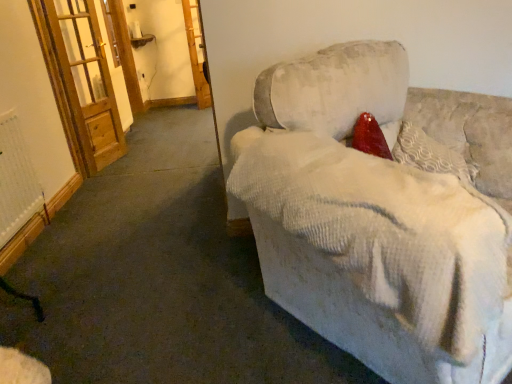
Find the location of a particular element. Image resolution: width=512 pixels, height=384 pixels. velvet beige couch at center is located at coordinates (372, 225).

This screenshot has width=512, height=384. In order to click on textured cream pillow at upper right in this screenshot , I will do `click(430, 154)`.

Where is `white textured radiator at lower left`? white textured radiator at lower left is located at coordinates (16, 180).

Where is `wooden screen door at upper left, the 2th screen door from the front`? This screenshot has height=384, width=512. wooden screen door at upper left, the 2th screen door from the front is located at coordinates (196, 52).

Considering the relative sizes of wooden screen door at upper left, the 2th screen door from the front, and textured cream pillow at upper right in the image provided, is wooden screen door at upper left, the 2th screen door from the front, bigger than textured cream pillow at upper right?

No, wooden screen door at upper left, the 2th screen door from the front, is not bigger than textured cream pillow at upper right.

Which is more to the left, wooden screen door at upper left, which is counted as the second screen door, starting from the left, or textured cream pillow at upper right?

wooden screen door at upper left, which is counted as the second screen door, starting from the left, is more to the left.

Which of these two, wooden screen door at upper left, placed as the first screen door when sorted from back to front, or textured cream pillow at upper right, stands shorter?

textured cream pillow at upper right.

From the image's perspective, relative to wooden screen door at left, the 1th screen door from the left, is velvet beige couch at center above or below?

velvet beige couch at center is below wooden screen door at left, the 1th screen door from the left.

Consider the image. Is velvet beige couch at center located outside wooden screen door at left, positioned as the first screen door in front-to-back order?

Yes, velvet beige couch at center is not within wooden screen door at left, positioned as the first screen door in front-to-back order.

Considering the positions of point (204, 105) and point (82, 14), is point (204, 105) closer or farther from the camera than point (82, 14)?

Point (204, 105) is farther from the camera than point (82, 14).

Does wooden screen door at upper left, which is counted as the second screen door, starting from the left, have a lesser height compared to wooden screen door at left, the second screen door viewed from the right?

Correct, wooden screen door at upper left, which is counted as the second screen door, starting from the left, is not as tall as wooden screen door at left, the second screen door viewed from the right.

From the image's perspective, would you say wooden screen door at upper left, marked as the first screen door in a right-to-left arrangement, is shown under wooden screen door at left, the second screen door viewed from the right?

No.

Relative to wooden screen door at left, the 1th screen door from the left, is wooden screen door at upper left, which is counted as the second screen door, starting from the left, in front or behind?

wooden screen door at upper left, which is counted as the second screen door, starting from the left, is behind wooden screen door at left, the 1th screen door from the left.

Would you say textured cream pillow at upper right is to the left or to the right of wooden screen door at left, the second screen door viewed from the right, in the picture?

In the image, textured cream pillow at upper right appears on the right side of wooden screen door at left, the second screen door viewed from the right.

Measure the distance from textured cream pillow at upper right to wooden screen door at left, the 1th screen door from the left.

2.70 meters.

How many degrees apart are the facing directions of textured cream pillow at upper right and wooden screen door at left, positioned as the first screen door in front-to-back order?

29.9 degrees separate the facing orientations of textured cream pillow at upper right and wooden screen door at left, positioned as the first screen door in front-to-back order.

Is textured cream pillow at upper right positioned beyond the bounds of wooden screen door at left, positioned as the 2th screen door in back-to-front order?

textured cream pillow at upper right lies outside wooden screen door at left, positioned as the 2th screen door in back-to-front order,'s area.

Between wooden screen door at left, positioned as the first screen door in front-to-back order, and wooden screen door at upper left, which is counted as the second screen door, starting from the left, which one has smaller size?

With smaller size is wooden screen door at upper left, which is counted as the second screen door, starting from the left.

Can you confirm if wooden screen door at left, positioned as the first screen door in front-to-back order, is thinner than wooden screen door at upper left, marked as the first screen door in a right-to-left arrangement?

No.

Are wooden screen door at left, the 1th screen door from the left, and wooden screen door at upper left, placed as the first screen door when sorted from back to front, far apart?

Yes, wooden screen door at left, the 1th screen door from the left, is far from wooden screen door at upper left, placed as the first screen door when sorted from back to front.

Which point is more distant from viewer, (5, 144) or (432, 157)?

The point (5, 144) is farther from the camera.

Which of these two, white textured radiator at lower left or textured cream pillow at upper right, stands shorter?

textured cream pillow at upper right.

Is white textured radiator at lower left not within textured cream pillow at upper right?

white textured radiator at lower left is positioned outside textured cream pillow at upper right.

Is white textured radiator at lower left next to textured cream pillow at upper right and touching it?

white textured radiator at lower left is not next to textured cream pillow at upper right, and they're not touching.

Is the position of textured cream pillow at upper right less distant than that of velvet beige couch at center?

No, textured cream pillow at upper right is further to the viewer.

Is textured cream pillow at upper right with velvet beige couch at center?

No.

From the image's perspective, is textured cream pillow at upper right located above velvet beige couch at center?

Indeed, from the image's perspective, textured cream pillow at upper right is shown above velvet beige couch at center.

Can you tell me how much textured cream pillow at upper right and velvet beige couch at center differ in facing direction?

The angle between the facing direction of textured cream pillow at upper right and the facing direction of velvet beige couch at center is 4.32 degrees.

This screenshot has height=384, width=512. Find the location of `pillow below the wooden screen door at upper left, which is counted as the second screen door, starting from the left (from the image's perspective)`. pillow below the wooden screen door at upper left, which is counted as the second screen door, starting from the left (from the image's perspective) is located at coordinates (430, 154).

You are a GUI agent. You are given a task and a screenshot of the screen. Output one action in this format:
    pyautogui.click(x=<x>, y=<y>)
    Task: Click on the studio couch that appears on the right of wooden screen door at left, the second screen door viewed from the right
    
    Given the screenshot: What is the action you would take?
    pyautogui.click(x=372, y=225)

Estimate the real-world distances between objects in this image. Which object is closer to white textured radiator at lower left, wooden screen door at left, positioned as the 2th screen door in back-to-front order, or velvet beige couch at center?

wooden screen door at left, positioned as the 2th screen door in back-to-front order.

Considering their positions, is wooden screen door at upper left, which is counted as the second screen door, starting from the left, positioned further to velvet beige couch at center than textured cream pillow at upper right?

wooden screen door at upper left, which is counted as the second screen door, starting from the left, is further to velvet beige couch at center.

From the image, which object appears to be farther from wooden screen door at left, the 1th screen door from the left, textured cream pillow at upper right or velvet beige couch at center?

Based on the image, textured cream pillow at upper right appears to be further to wooden screen door at left, the 1th screen door from the left.

When comparing their distances from velvet beige couch at center, does white textured radiator at lower left or textured cream pillow at upper right seem closer?

textured cream pillow at upper right lies closer to velvet beige couch at center than the other object.

From the image, which object appears to be farther from wooden screen door at upper left, the 2th screen door from the front, white textured radiator at lower left or velvet beige couch at center?

Among the two, velvet beige couch at center is located further to wooden screen door at upper left, the 2th screen door from the front.

Looking at the image, which one is located further to textured cream pillow at upper right, wooden screen door at left, positioned as the 2th screen door in back-to-front order, or wooden screen door at upper left, marked as the first screen door in a right-to-left arrangement?

The object further to textured cream pillow at upper right is wooden screen door at upper left, marked as the first screen door in a right-to-left arrangement.

Estimate the real-world distances between objects in this image. Which object is closer to textured cream pillow at upper right, velvet beige couch at center or white textured radiator at lower left?

velvet beige couch at center is positioned closer to the anchor textured cream pillow at upper right.

Considering their positions, is wooden screen door at left, the second screen door viewed from the right, positioned closer to velvet beige couch at center than wooden screen door at upper left, marked as the first screen door in a right-to-left arrangement?

wooden screen door at left, the second screen door viewed from the right.

At what (x,y) coordinates should I click in order to perform the action: click on screen door positioned between white textured radiator at lower left and wooden screen door at upper left, which is counted as the second screen door, starting from the left, from near to far. Please return your answer as a coordinate pair (x, y). The height and width of the screenshot is (384, 512). Looking at the image, I should click on (86, 80).

Locate an element on the screen. Image resolution: width=512 pixels, height=384 pixels. screen door between velvet beige couch at center and wooden screen door at upper left, placed as the first screen door when sorted from back to front, along the z-axis is located at coordinates (86, 80).

Where is `radiator between textured cream pillow at upper right and wooden screen door at upper left, marked as the first screen door in a right-to-left arrangement, along the z-axis`? radiator between textured cream pillow at upper right and wooden screen door at upper left, marked as the first screen door in a right-to-left arrangement, along the z-axis is located at coordinates (16, 180).

Identify the location of radiator between velvet beige couch at center and wooden screen door at left, positioned as the 2th screen door in back-to-front order, from front to back. (16, 180).